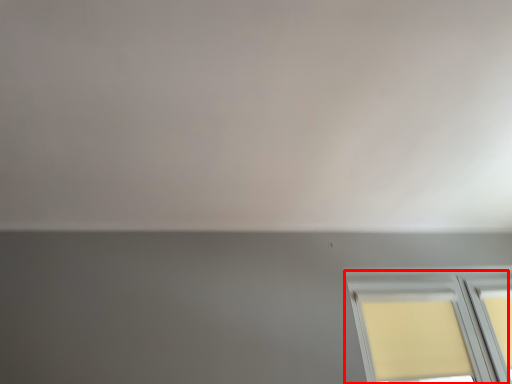
Question: From the image's perspective, where is window (annotated by the red box) located relative to backdrop?

Choices:
 (A) below
 (B) above

Answer: (A)